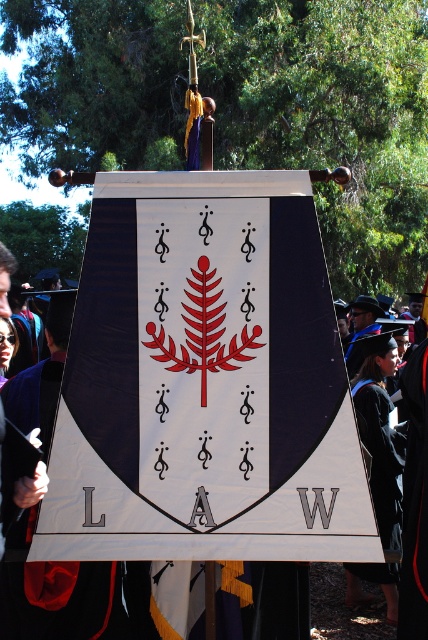
Between point (26, 586) and point (422, 333), which one is positioned in front?

Positioned in front is point (26, 586).

Which is more to the right, matte black robe at center or matte black graduation gown at center?

matte black graduation gown at center

This screenshot has height=640, width=428. Find the location of `matte black robe at center`. matte black robe at center is located at coordinates (62, 600).

Can you confirm if matte black robe at center is wider than black matte graduation gown at lower right?

Indeed, matte black robe at center has a greater width compared to black matte graduation gown at lower right.

What do you see at coordinates (62, 600) in the screenshot? The image size is (428, 640). I see `matte black robe at center` at bounding box center [62, 600].

You are a GUI agent. You are given a task and a screenshot of the screen. Output one action in this format:
    pyautogui.click(x=<x>, y=<y>)
    Task: Click on the matte black robe at center
    
    Given the screenshot: What is the action you would take?
    pyautogui.click(x=62, y=600)

Does white matte fabric at center have a smaller size compared to matte black graduation gown at center?

Correct, white matte fabric at center occupies less space than matte black graduation gown at center.

Is point (311, 280) farther from camera compared to point (422, 305)?

No, (311, 280) is in front of (422, 305).

Describe the element at coordinates (205, 381) in the screenshot. I see `white matte fabric at center` at that location.

At what (x,y) coordinates should I click in order to perform the action: click on white matte fabric at center. Please return your answer as a coordinate pair (x, y). The image size is (428, 640). Looking at the image, I should click on (205, 381).